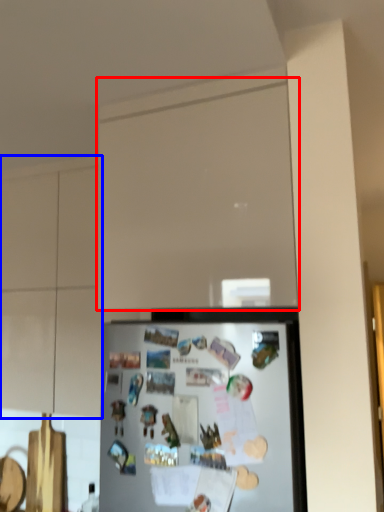
Question: Which object is further to the camera taking this photo, glass door (highlighted by a red box) or cabinetry (highlighted by a blue box)?

Choices:
 (A) glass door
 (B) cabinetry

Answer: (B)